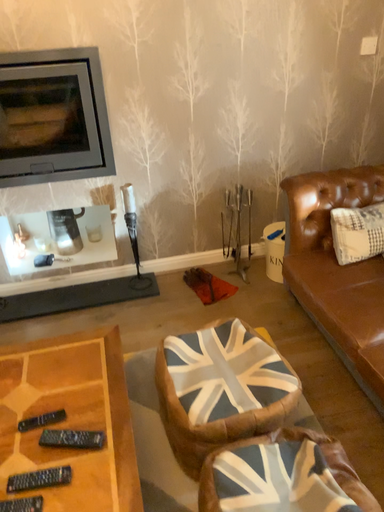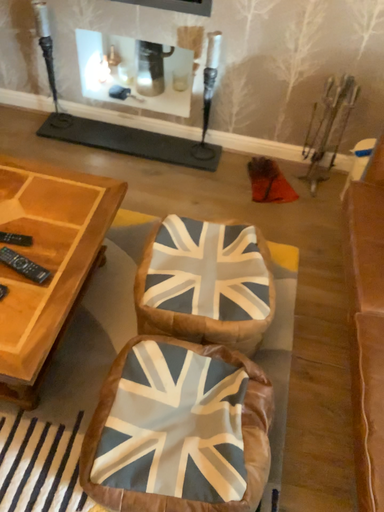
Question: How did the camera likely rotate when shooting the video?

Choices:
 (A) rotated downward
 (B) rotated upward

Answer: (A)